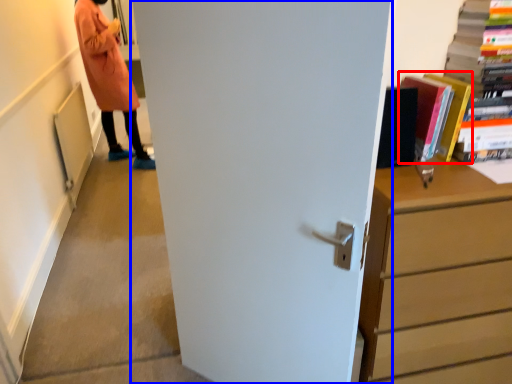
Question: Which object is closer to the camera taking this photo, book (highlighted by a red box) or door (highlighted by a blue box)?

Choices:
 (A) book
 (B) door

Answer: (B)